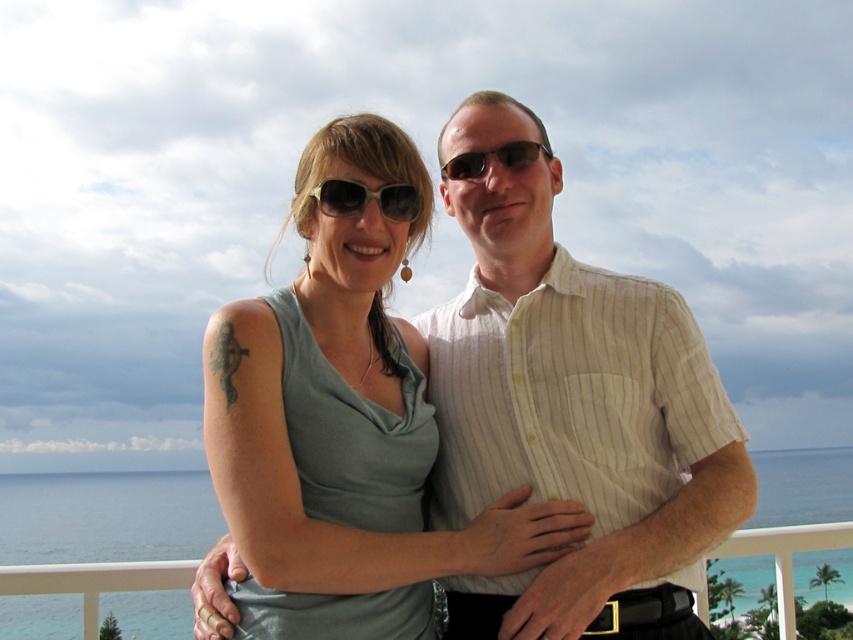
From the picture: You are standing on a balcony overlooking the ocean and want to reach a specific point marked at coordinates point (488, 170). If you take three steps forward, each step covering 1.2 meters, will you reach that point?

The point (488, 170) is 3.65 meters away from the viewer. Taking three steps of 1.2 meters each would cover 3.6 meters, which is slightly less than the required distance. Therefore, you would not quite reach the point.

Consider the image. You are a photographer trying to capture a closeup of the matte gray tank top at center and the matte black sunglasses at center. Which object should you focus on first if you want to ensure both are in focus?

The matte gray tank top at center is below matte black sunglasses at center, so you should focus on the matte black sunglasses at center first to ensure both are in focus.

Consider the image. You are a photographer trying to capture a closeup of the matte gray tank top at center and the matte yellow sunglasses at center. Since you want to focus on the tank top, which object should you position closer to the camera?

The matte gray tank top at center should be positioned closer to the camera since it is to the left of the matte yellow sunglasses at center, allowing the photographer to focus on it while still capturing both objects in the frame.